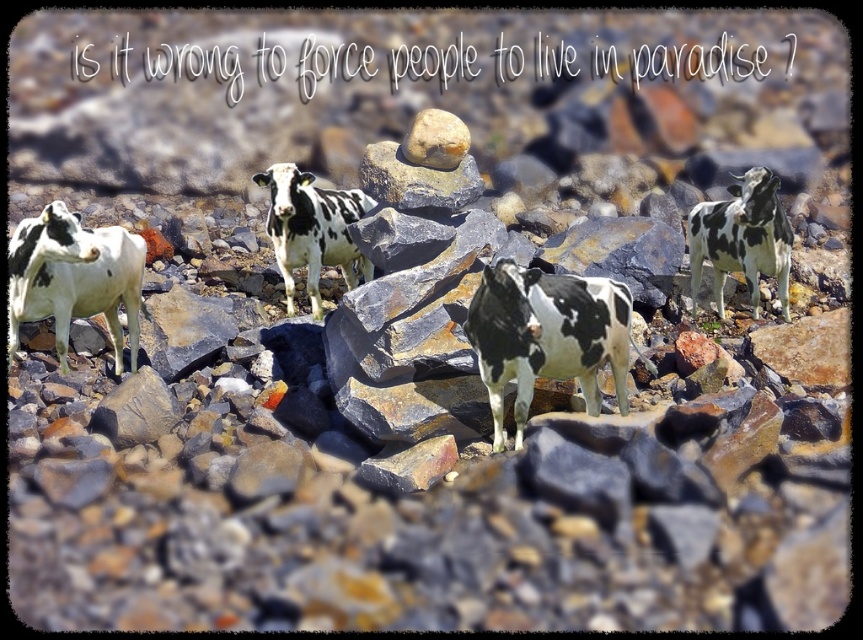
Question: Which of the following is the closest to the observer?

Choices:
 (A) black-and-white spotted cow at upper right
 (B) black-and-white cow at center

Answer: (B)

Question: Which of the following is the closest to the observer?

Choices:
 (A) black and white spotted cow at center
 (B) black-and-white spotted cow at upper right
 (C) white and black spotted cow at left
 (D) black-and-white cow at center

Answer: (D)

Question: Can you confirm if black-and-white cow at center is smaller than white and black spotted cow at left?

Choices:
 (A) no
 (B) yes

Answer: (B)

Question: Is black-and-white cow at center smaller than white and black spotted cow at left?

Choices:
 (A) yes
 (B) no

Answer: (A)

Question: Which object is farther from the camera taking this photo?

Choices:
 (A) black-and-white spotted cow at upper right
 (B) white and black spotted cow at left
 (C) black-and-white cow at center
 (D) black and white spotted cow at center

Answer: (D)

Question: Is black-and-white spotted cow at upper right behind black and white spotted cow at center?

Choices:
 (A) yes
 (B) no

Answer: (B)